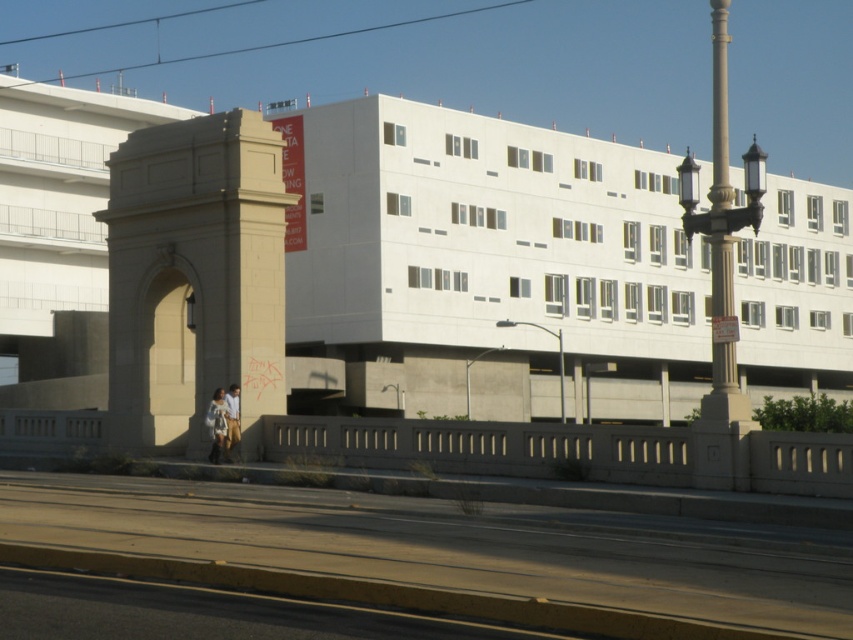
What do you see at coordinates (194, 276) in the screenshot?
I see `beige stone arch at left` at bounding box center [194, 276].

Is beige stone arch at left to the left of light brown leather jacket at lower center from the viewer's perspective?

Indeed, beige stone arch at left is positioned on the left side of light brown leather jacket at lower center.

Which is behind, point (163, 192) or point (229, 392)?

The point (163, 192) is behind.

Locate an element on the screen. This screenshot has width=853, height=640. beige stone arch at left is located at coordinates [194, 276].

Is beige stone arch at left above white fabric bag at center?

Yes, beige stone arch at left is above white fabric bag at center.

Is beige stone arch at left shorter than white fabric bag at center?

No.

The height and width of the screenshot is (640, 853). Find the location of `beige stone arch at left`. beige stone arch at left is located at coordinates (194, 276).

In the scene shown: How much distance is there between white fabric bag at center and light brown leather jacket at lower center?

The distance of white fabric bag at center from light brown leather jacket at lower center is 7.87 inches.

Is white fabric bag at center in front of light brown leather jacket at lower center?

Yes, it is in front of light brown leather jacket at lower center.

Locate an element on the screen. white fabric bag at center is located at coordinates (216, 424).

Identify the location of white fabric bag at center. This screenshot has height=640, width=853. 216,424.